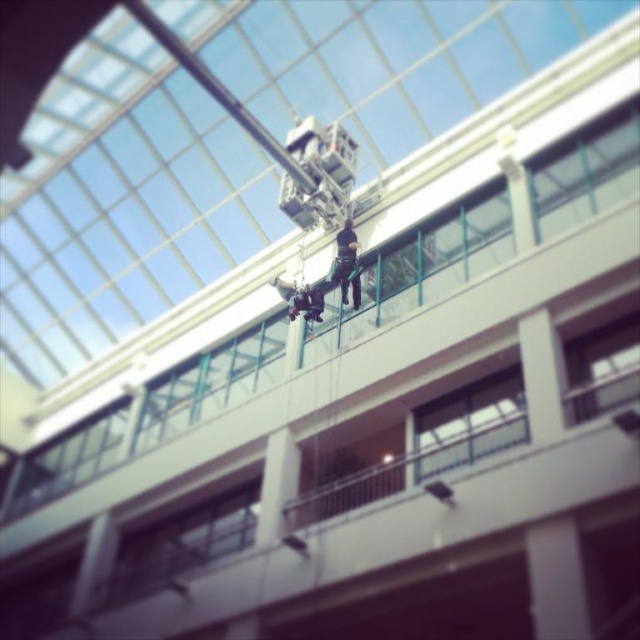
Is point (628, 134) in front of point (164, 552)?

Yes, it is in front of point (164, 552).

Identify the location of clear glass window at upper center. The image size is (640, 640). (586, 172).

Is clear glass window at center thinner than transparent glass window at center?

Incorrect, clear glass window at center's width is not less than transparent glass window at center's.

Is clear glass window at center bigger than transparent glass window at center?

Yes, clear glass window at center is bigger than transparent glass window at center.

You are a GUI agent. You are given a task and a screenshot of the screen. Output one action in this format:
    pyautogui.click(x=<x>, y=<y>)
    Task: Click on the clear glass window at center
    The width and height of the screenshot is (640, 640).
    Given the screenshot: What is the action you would take?
    pyautogui.click(x=468, y=422)

Does transparent glass window at lower center have a greater width compared to clear glass window at center?

No.

How distant is transparent glass window at lower center from clear glass window at center?

transparent glass window at lower center and clear glass window at center are 11.55 meters apart from each other.

Is point (182, 548) closer to camera compared to point (492, 428)?

No, it is not.

Locate an element on the screen. The width and height of the screenshot is (640, 640). transparent glass window at lower center is located at coordinates (182, 544).